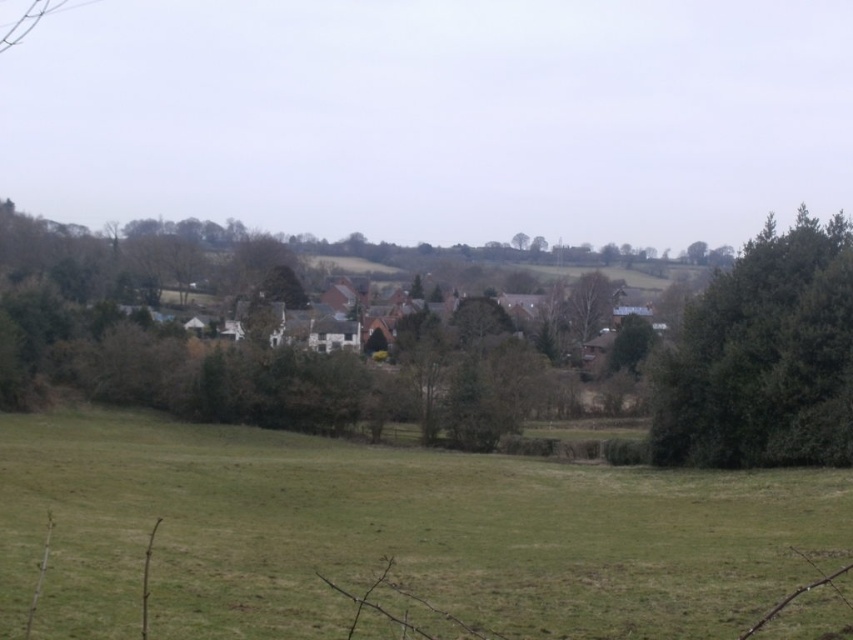
Question: Among these objects, which one is farthest from the camera?

Choices:
 (A) green leafy tree at right
 (B) green grass at lower center

Answer: (A)

Question: Does green grass at lower center appear on the right side of green leafy tree at right?

Choices:
 (A) yes
 (B) no

Answer: (B)

Question: Can you confirm if green grass at lower center is positioned to the right of green leafy tree at right?

Choices:
 (A) yes
 (B) no

Answer: (B)

Question: Among these objects, which one is farthest from the camera?

Choices:
 (A) green leafy tree at right
 (B) green grass at lower center

Answer: (A)

Question: Can you confirm if green grass at lower center is positioned to the right of green leafy tree at right?

Choices:
 (A) yes
 (B) no

Answer: (B)

Question: Which object is farther from the camera taking this photo?

Choices:
 (A) green grass at lower center
 (B) green leafy tree at right

Answer: (B)